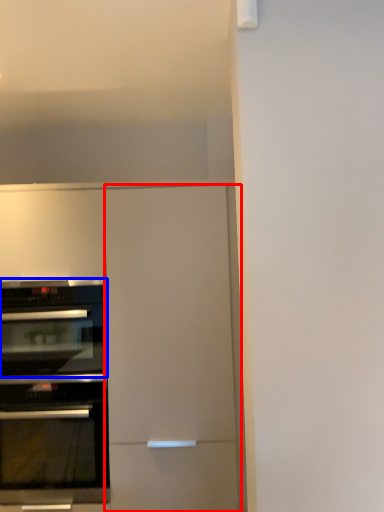
Question: Which point is further to the camera, door (highlighted by a red box) or oven (highlighted by a blue box)?

Choices:
 (A) door
 (B) oven

Answer: (B)